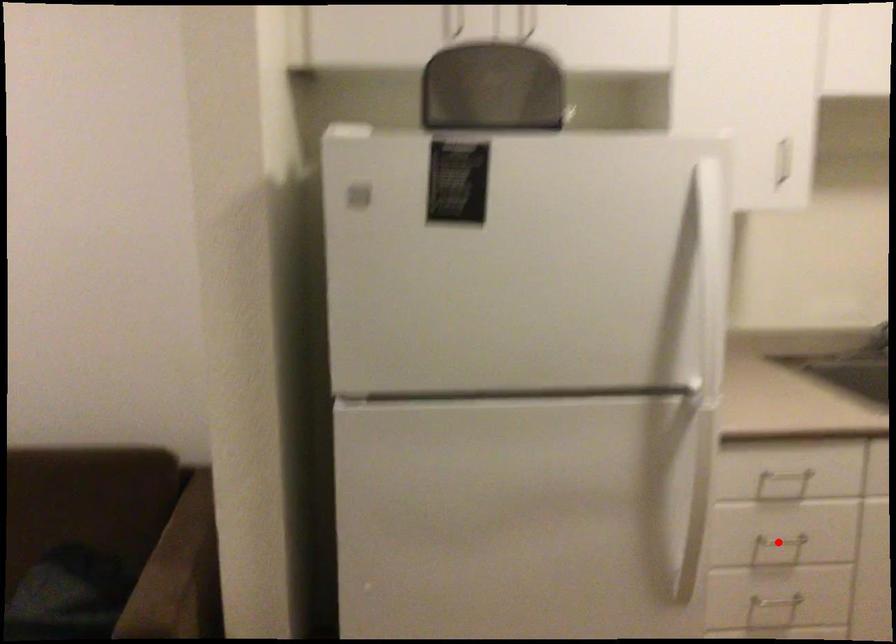
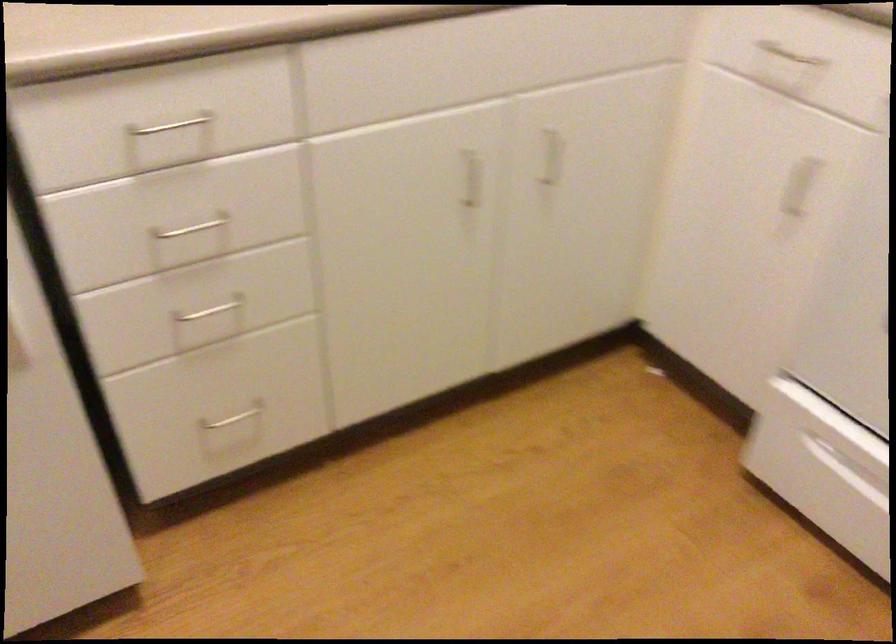
Locate, in the second image, the point that corresponds to the highlighted location in the first image.

(192, 228)